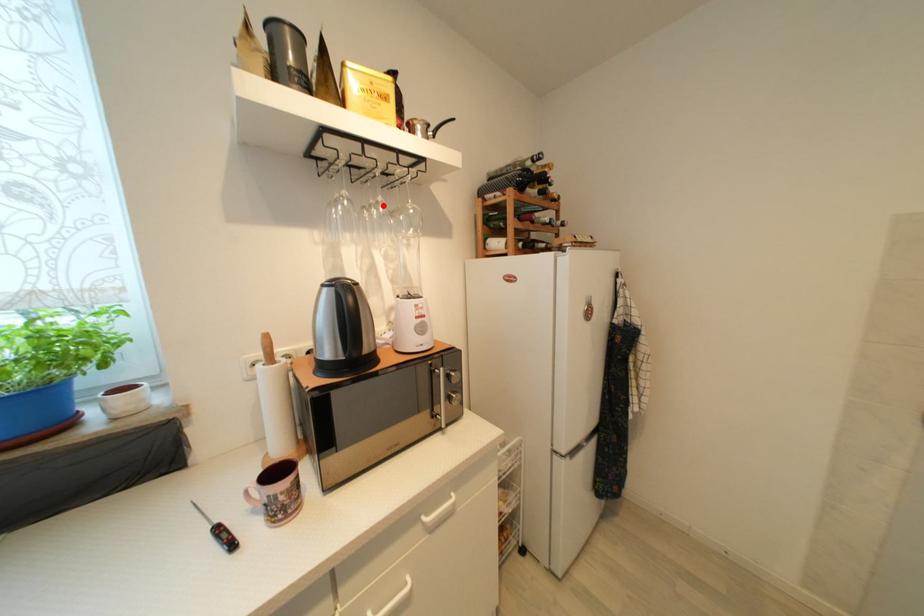
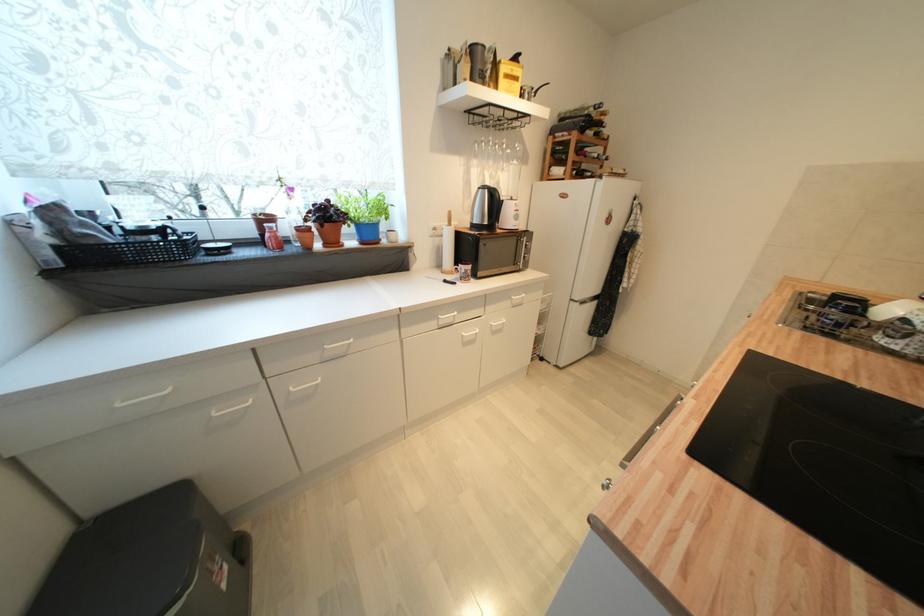
In the second image, find the point that corresponds to the highlighted location in the first image.

(507, 146)